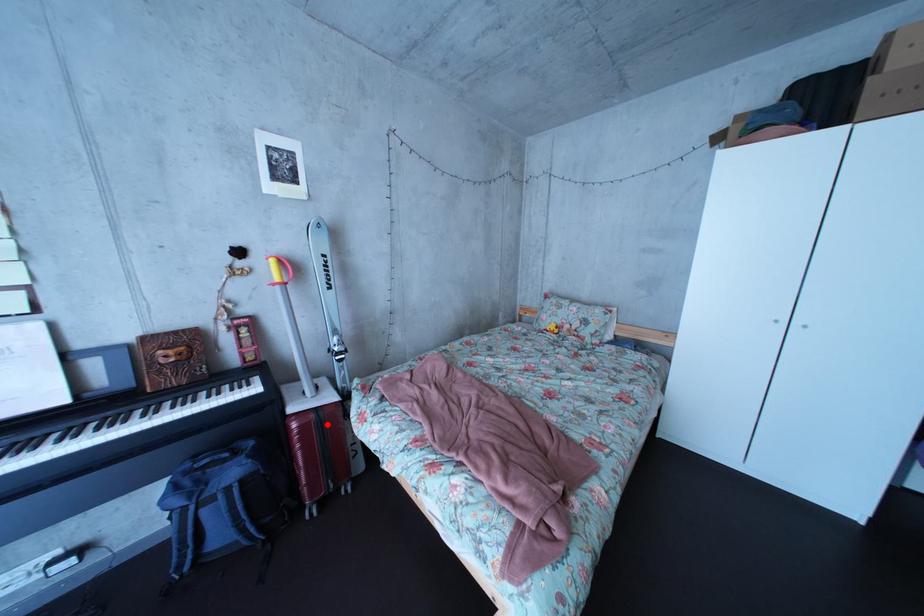
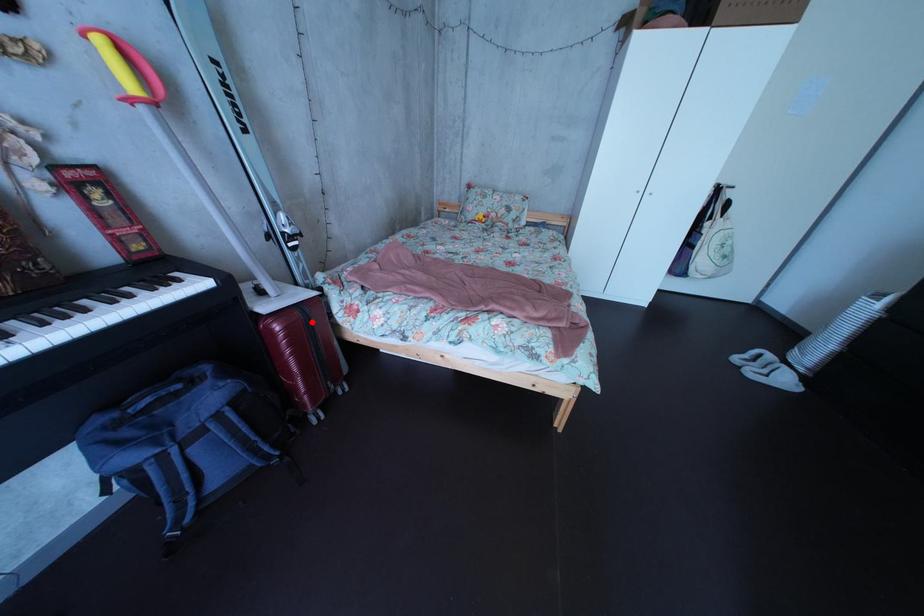
I am providing you with two images of the same scene from different viewpoints. A red point is marked on the first image and another point is marked on the second image. Is the marked point in image1 the same physical position as the marked point in image2?

Yes